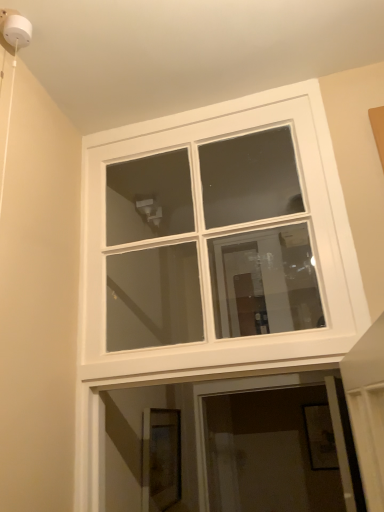
Question: Should I look upward or downward to see white glass window at upper center?

Choices:
 (A) up
 (B) down

Answer: (A)